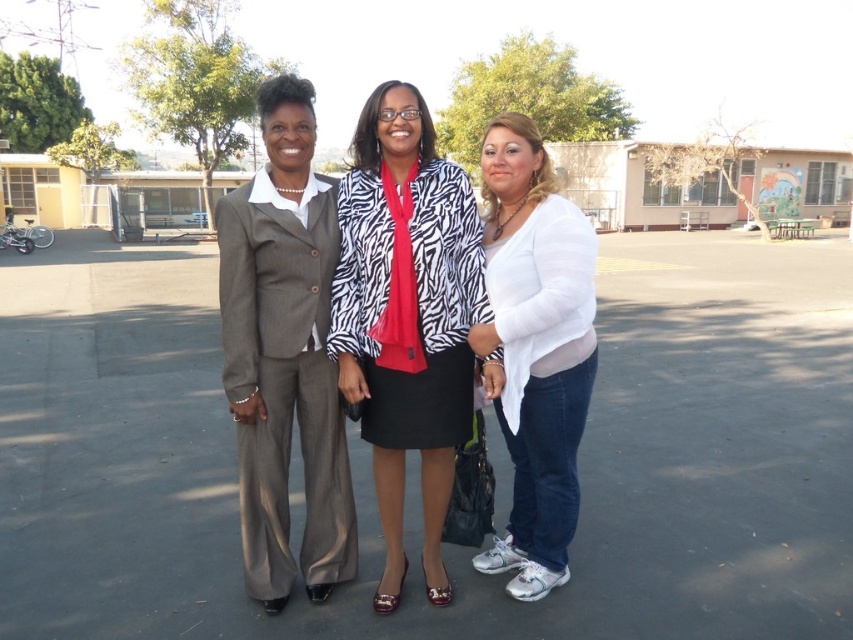
Does point (32, 417) come farther from viewer compared to point (525, 276)?

Yes, it is.

At what (x,y) coordinates should I click in order to perform the action: click on black asphalt parking lot at center. Please return your answer as a coordinate pair (x, y). The height and width of the screenshot is (640, 853). Looking at the image, I should click on (416, 461).

What are the coordinates of `black asphalt parking lot at center` in the screenshot? It's located at (416, 461).

Does black asphalt parking lot at center have a lesser width compared to matte gray suit at left?

No, black asphalt parking lot at center is not thinner than matte gray suit at left.

Who is higher up, black asphalt parking lot at center or matte gray suit at left?

Positioned higher is black asphalt parking lot at center.

I want to click on black asphalt parking lot at center, so click(x=416, y=461).

Who is positioned more to the right, zebra print jacket at center or matte gray suit at left?

zebra print jacket at center

Between point (399, 340) and point (300, 435), which one is positioned in front?

Point (399, 340) is in front.

Who is more forward, [415,168] or [294,348]?

Positioned in front is point [294,348].

Find the location of a particular element. The image size is (853, 640). zebra print jacket at center is located at coordinates (405, 316).